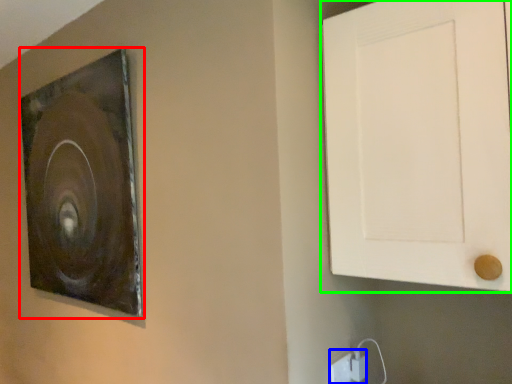
Question: Considering the real-world distances, which object is closest to picture frame (highlighted by a red box)? electric outlet (highlighted by a blue box) or door (highlighted by a green box).

Choices:
 (A) electric outlet
 (B) door

Answer: (B)